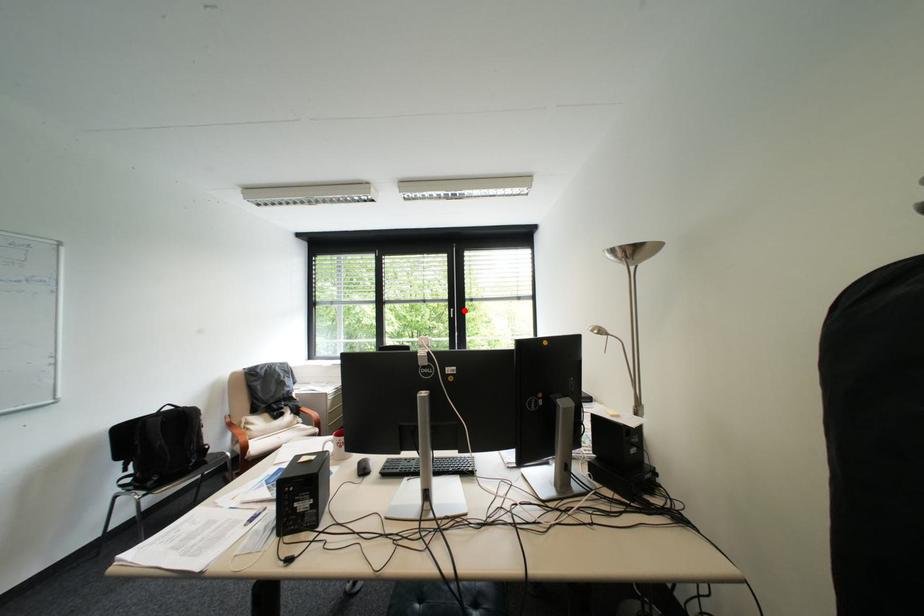
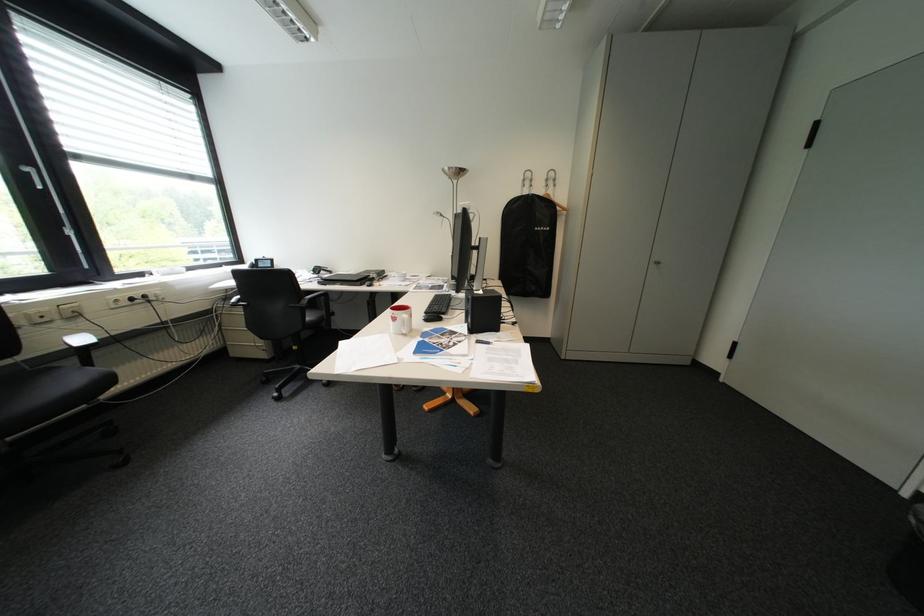
Find the pixel in the second image that matches the highlighted location in the first image.

(41, 169)